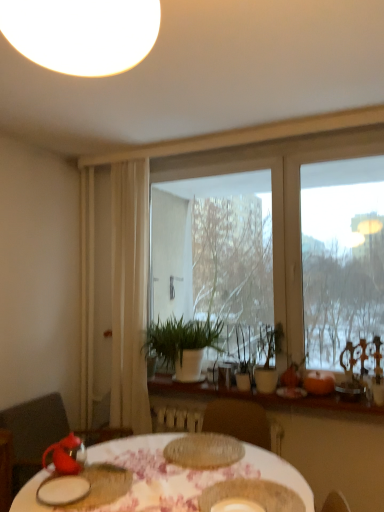
Find the location of a particular element. Image resolution: width=384 pixels, height=512 pixels. empty space that is ontop of white floral table at center (from a real-world perspective) is located at coordinates (183, 473).